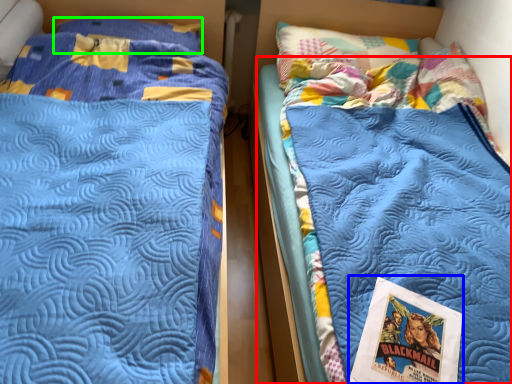
Question: Which is nearer to the mattress (highlighted by a red box)? comic book (highlighted by a blue box) or pillow (highlighted by a green box).

Choices:
 (A) comic book
 (B) pillow

Answer: (A)